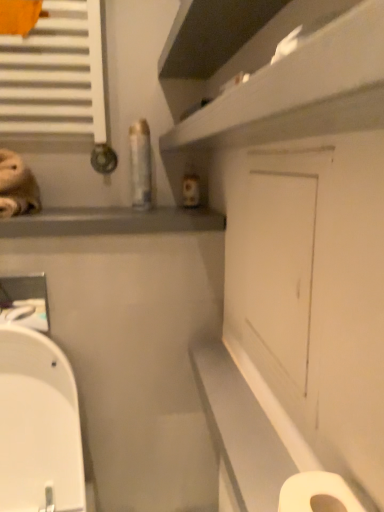
Question: Is white glossy shelf at upper center far from white matte door at center?

Choices:
 (A) no
 (B) yes

Answer: (A)

Question: From a real-world perspective, is white glossy shelf at upper center below white matte door at center?

Choices:
 (A) no
 (B) yes

Answer: (A)

Question: From the image's perspective, would you say white glossy shelf at upper center is positioned over white matte door at center?

Choices:
 (A) no
 (B) yes

Answer: (B)

Question: Is white glossy shelf at upper center taller than white matte door at center?

Choices:
 (A) no
 (B) yes

Answer: (A)

Question: Does white glossy shelf at upper center turn towards white matte door at center?

Choices:
 (A) yes
 (B) no

Answer: (B)

Question: Considering the positions of white matte door at center and white matte toilet paper at lower right in the image, is white matte door at center wider or thinner than white matte toilet paper at lower right?

Choices:
 (A) wide
 (B) thin

Answer: (B)

Question: Does point (289, 332) appear closer or farther from the camera than point (329, 489)?

Choices:
 (A) closer
 (B) farther

Answer: (B)

Question: In the image, is white matte door at center on the left side or the right side of white matte toilet paper at lower right?

Choices:
 (A) left
 (B) right

Answer: (B)

Question: From the image's perspective, relative to white matte toilet paper at lower right, is white matte door at center above or below?

Choices:
 (A) below
 (B) above

Answer: (B)

Question: Looking at the image, does white glossy shelf at upper center seem bigger or smaller compared to white matte toilet paper at lower right?

Choices:
 (A) big
 (B) small

Answer: (A)

Question: From their relative heights in the image, would you say white glossy shelf at upper center is taller or shorter than white matte toilet paper at lower right?

Choices:
 (A) short
 (B) tall

Answer: (A)

Question: Choose the correct answer: Is white glossy shelf at upper center inside white matte toilet paper at lower right or outside it?

Choices:
 (A) inside
 (B) outside

Answer: (B)

Question: Relative to white matte toilet paper at lower right, is white glossy shelf at upper center in front or behind?

Choices:
 (A) behind
 (B) front

Answer: (B)

Question: Considering the positions of white matte toilet paper at lower right and matte gray window sill at upper left in the image, is white matte toilet paper at lower right wider or thinner than matte gray window sill at upper left?

Choices:
 (A) wide
 (B) thin

Answer: (B)

Question: In the image, is white matte toilet paper at lower right on the left side or the right side of matte gray window sill at upper left?

Choices:
 (A) right
 (B) left

Answer: (A)